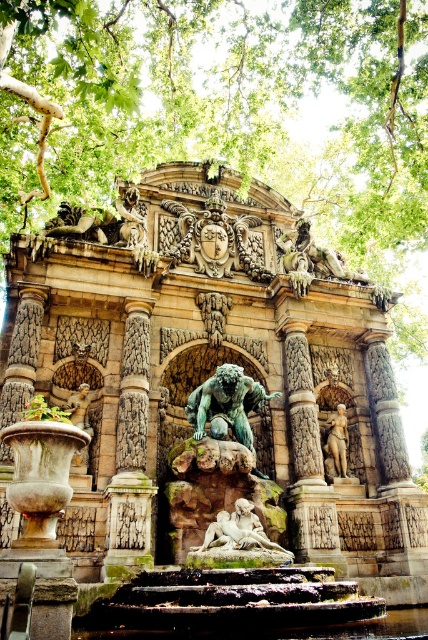
Which of these two, carved stone fountain at center or carved stone column at center, stands shorter?

With less height is carved stone column at center.

Between carved stone fountain at center and carved stone column at center, which one is positioned higher?

Answer: Positioned higher is carved stone fountain at center.

Where is `carved stone fountain at center`? The image size is (428, 640). carved stone fountain at center is located at coordinates (213, 372).

Measure the distance between carved stone column at center and bronze statue at center.

carved stone column at center and bronze statue at center are 10.50 meters apart.

Image resolution: width=428 pixels, height=640 pixels. What are the coordinates of `carved stone column at center` in the screenshot? It's located at (130, 452).

What are the coordinates of `carved stone column at center` in the screenshot? It's located at (130, 452).

Does point (53, 264) come closer to viewer compared to point (357, 10)?

Yes, it is.

Which is more to the right, carved stone fountain at center or green leafy tree at upper center?

green leafy tree at upper center is more to the right.

Where is `carved stone fountain at center`? This screenshot has width=428, height=640. carved stone fountain at center is located at coordinates (213, 372).

The width and height of the screenshot is (428, 640). In order to click on carved stone fountain at center in this screenshot , I will do `click(213, 372)`.